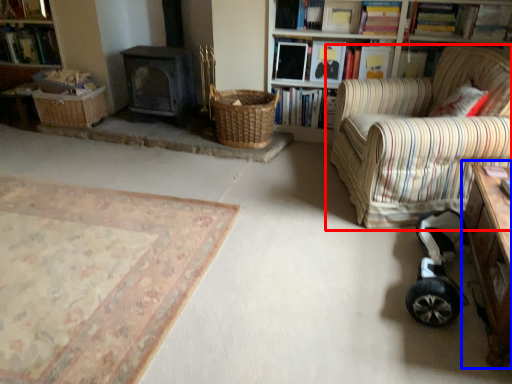
Question: Which object appears closest to the camera in this image, chair (highlighted by a red box) or table (highlighted by a blue box)?

Choices:
 (A) chair
 (B) table

Answer: (B)